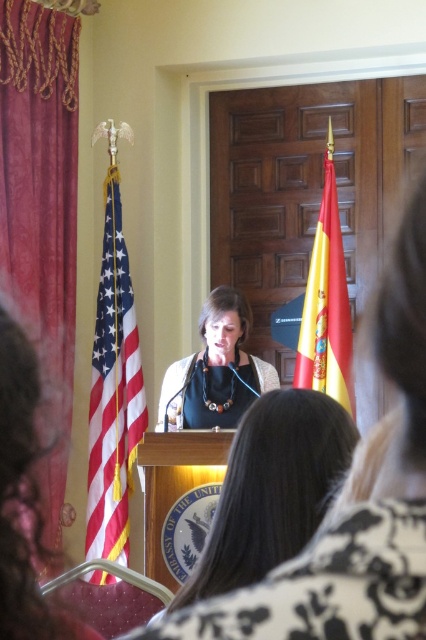
Question: Among these points, which one is nearest to the camera?

Choices:
 (A) (351, 448)
 (B) (308, 353)

Answer: (A)

Question: Estimate the real-world distances between objects in this image. Which object is farther from the american flag at left?

Choices:
 (A) matte black podium at center
 (B) matte black necklace at center

Answer: (A)

Question: Is matte black podium at center further to the viewer compared to matte black necklace at center?

Choices:
 (A) yes
 (B) no

Answer: (B)

Question: Observing the image, what is the correct spatial positioning of matte black podium at center in reference to matte black necklace at center?

Choices:
 (A) left
 (B) right

Answer: (B)

Question: Is american flag at left behind yellow/red fabric flag at right?

Choices:
 (A) yes
 (B) no

Answer: (A)

Question: Among these points, which one is farthest from the camera?

Choices:
 (A) (327, 305)
 (B) (100, 396)
 (C) (172, 609)

Answer: (B)